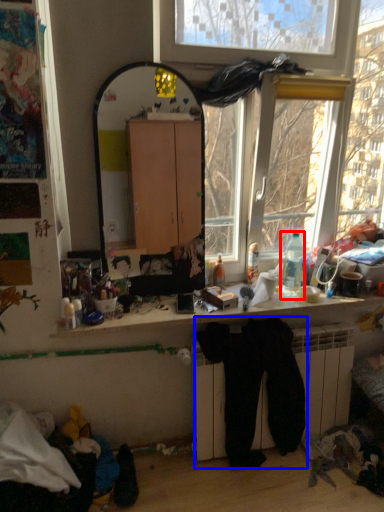
Question: Among these objects, which one is nearest to the camera, bottle (highlighted by a red box) or clothing (highlighted by a blue box)?

Choices:
 (A) bottle
 (B) clothing

Answer: (B)